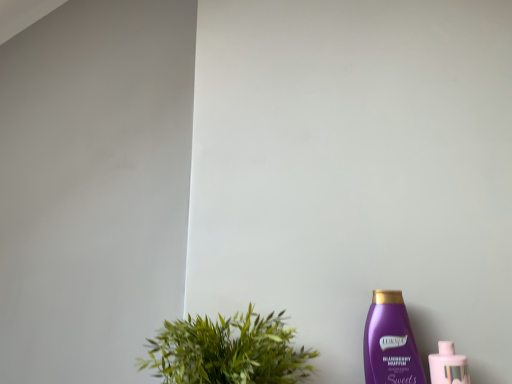
Consider the image. Measure the distance between point [200,354] and camera.

Point [200,354] and camera are 65.70 centimeters apart.

The height and width of the screenshot is (384, 512). Describe the element at coordinates (448, 365) in the screenshot. I see `pink glossy bottle at lower right, arranged as the first bottle when viewed from the right` at that location.

Measure the distance between pink glossy bottle at lower right, which is the second bottle from left to right, and camera.

pink glossy bottle at lower right, which is the second bottle from left to right, and camera are 28.83 inches apart.

The height and width of the screenshot is (384, 512). In order to click on green leafy plant at lower left in this screenshot , I will do `click(228, 351)`.

Which is more distant, [275,351] or [440,367]?

The point [440,367] is farther from the camera.

Is green leafy plant at lower left bigger or smaller than pink glossy bottle at lower right, which is the second bottle from left to right?

In the image, green leafy plant at lower left appears to be larger than pink glossy bottle at lower right, which is the second bottle from left to right.

Is green leafy plant at lower left not close to pink glossy bottle at lower right, which is the second bottle from left to right?

green leafy plant at lower left is near pink glossy bottle at lower right, which is the second bottle from left to right, not far away.

Looking at this image, is pink glossy bottle at lower right, arranged as the first bottle when viewed from the right, to the right of purple plastic bottle at lower right, marked as the second bottle in a right-to-left arrangement, from the viewer's perspective?

Indeed, pink glossy bottle at lower right, arranged as the first bottle when viewed from the right, is positioned on the right side of purple plastic bottle at lower right, marked as the second bottle in a right-to-left arrangement.

Is pink glossy bottle at lower right, which is the second bottle from left to right, not within purple plastic bottle at lower right, the first bottle in the left-to-right sequence?

pink glossy bottle at lower right, which is the second bottle from left to right, is positioned outside purple plastic bottle at lower right, the first bottle in the left-to-right sequence.

From the image's perspective, is pink glossy bottle at lower right, arranged as the first bottle when viewed from the right, above or below purple plastic bottle at lower right, marked as the second bottle in a right-to-left arrangement?

Clearly, from the image's perspective, pink glossy bottle at lower right, arranged as the first bottle when viewed from the right, is below purple plastic bottle at lower right, marked as the second bottle in a right-to-left arrangement.

You are a GUI agent. You are given a task and a screenshot of the screen. Output one action in this format:
    pyautogui.click(x=<x>, y=<y>)
    Task: Click on the bottle below the purple plastic bottle at lower right, marked as the second bottle in a right-to-left arrangement (from a real-world perspective)
    
    Given the screenshot: What is the action you would take?
    pyautogui.click(x=448, y=365)

Consider the image. Can you tell me how much purple plastic bottle at lower right, marked as the second bottle in a right-to-left arrangement, and green leafy plant at lower left differ in facing direction?

The facing directions of purple plastic bottle at lower right, marked as the second bottle in a right-to-left arrangement, and green leafy plant at lower left are 0.000581 degrees apart.

Does purple plastic bottle at lower right, marked as the second bottle in a right-to-left arrangement, contain green leafy plant at lower left?

Actually, green leafy plant at lower left is outside purple plastic bottle at lower right, marked as the second bottle in a right-to-left arrangement.

Is there a large distance between purple plastic bottle at lower right, marked as the second bottle in a right-to-left arrangement, and green leafy plant at lower left?

No, purple plastic bottle at lower right, marked as the second bottle in a right-to-left arrangement, is in close proximity to green leafy plant at lower left.

Is purple plastic bottle at lower right, marked as the second bottle in a right-to-left arrangement, thinner than pink glossy bottle at lower right, which is the second bottle from left to right?

Correct, the width of purple plastic bottle at lower right, marked as the second bottle in a right-to-left arrangement, is less than that of pink glossy bottle at lower right, which is the second bottle from left to right.

From a real-world perspective, is purple plastic bottle at lower right, marked as the second bottle in a right-to-left arrangement, physically located above or below pink glossy bottle at lower right, arranged as the first bottle when viewed from the right?

Clearly, from a real-world perspective, purple plastic bottle at lower right, marked as the second bottle in a right-to-left arrangement, is above pink glossy bottle at lower right, arranged as the first bottle when viewed from the right.

Considering the sizes of purple plastic bottle at lower right, the first bottle in the left-to-right sequence, and pink glossy bottle at lower right, which is the second bottle from left to right, in the image, is purple plastic bottle at lower right, the first bottle in the left-to-right sequence, bigger or smaller than pink glossy bottle at lower right, which is the second bottle from left to right,?

Considering their sizes, purple plastic bottle at lower right, the first bottle in the left-to-right sequence, takes up more space than pink glossy bottle at lower right, which is the second bottle from left to right.

Could you tell me if green leafy plant at lower left is turned towards purple plastic bottle at lower right, marked as the second bottle in a right-to-left arrangement?

No, green leafy plant at lower left is not aimed at purple plastic bottle at lower right, marked as the second bottle in a right-to-left arrangement.

Where is `houseplant that appears above the purple plastic bottle at lower right, marked as the second bottle in a right-to-left arrangement (from a real-world perspective)`? The width and height of the screenshot is (512, 384). houseplant that appears above the purple plastic bottle at lower right, marked as the second bottle in a right-to-left arrangement (from a real-world perspective) is located at coordinates click(228, 351).

From a real-world perspective, is green leafy plant at lower left over purple plastic bottle at lower right, marked as the second bottle in a right-to-left arrangement?

Yes, from a real-world perspective, green leafy plant at lower left is above purple plastic bottle at lower right, marked as the second bottle in a right-to-left arrangement.

Considering the points (241, 336) and (394, 339), which point is in front, point (241, 336) or point (394, 339)?

The point (394, 339) is closer to the camera.

Between pink glossy bottle at lower right, which is the second bottle from left to right, and green leafy plant at lower left, which one has smaller width?

pink glossy bottle at lower right, which is the second bottle from left to right, is thinner.

From a real-world perspective, does pink glossy bottle at lower right, arranged as the first bottle when viewed from the right, sit lower than green leafy plant at lower left?

Indeed, from a real-world perspective, pink glossy bottle at lower right, arranged as the first bottle when viewed from the right, is positioned beneath green leafy plant at lower left.

Which is correct: pink glossy bottle at lower right, arranged as the first bottle when viewed from the right, is inside green leafy plant at lower left, or outside of it?

pink glossy bottle at lower right, arranged as the first bottle when viewed from the right, exists outside the volume of green leafy plant at lower left.

Locate an element on the screen. the 2nd bottle positioned below the green leafy plant at lower left (from the image's perspective) is located at coordinates (448, 365).

The height and width of the screenshot is (384, 512). Identify the location of bottle behind the purple plastic bottle at lower right, marked as the second bottle in a right-to-left arrangement. (448, 365).

Based on the photo, which object lies nearer to the anchor point pink glossy bottle at lower right, arranged as the first bottle when viewed from the right, purple plastic bottle at lower right, the first bottle in the left-to-right sequence, or green leafy plant at lower left?

Based on the image, purple plastic bottle at lower right, the first bottle in the left-to-right sequence, appears to be nearer to pink glossy bottle at lower right, arranged as the first bottle when viewed from the right.

Based on their spatial positions, is pink glossy bottle at lower right, which is the second bottle from left to right, or green leafy plant at lower left closer to purple plastic bottle at lower right, marked as the second bottle in a right-to-left arrangement?

pink glossy bottle at lower right, which is the second bottle from left to right.

When comparing their distances from pink glossy bottle at lower right, which is the second bottle from left to right, does green leafy plant at lower left or purple plastic bottle at lower right, the first bottle in the left-to-right sequence, seem closer?

purple plastic bottle at lower right, the first bottle in the left-to-right sequence.

From the picture: Which object lies further to the anchor point green leafy plant at lower left, pink glossy bottle at lower right, arranged as the first bottle when viewed from the right, or purple plastic bottle at lower right, the first bottle in the left-to-right sequence?

Based on the image, pink glossy bottle at lower right, arranged as the first bottle when viewed from the right, appears to be further to green leafy plant at lower left.

From the image, which object appears to be nearer to purple plastic bottle at lower right, the first bottle in the left-to-right sequence, green leafy plant at lower left or pink glossy bottle at lower right, which is the second bottle from left to right?

Based on the image, pink glossy bottle at lower right, which is the second bottle from left to right, appears to be nearer to purple plastic bottle at lower right, the first bottle in the left-to-right sequence.

Looking at the image, which one is located further to green leafy plant at lower left, purple plastic bottle at lower right, the first bottle in the left-to-right sequence, or pink glossy bottle at lower right, arranged as the first bottle when viewed from the right?

The object further to green leafy plant at lower left is pink glossy bottle at lower right, arranged as the first bottle when viewed from the right.

The image size is (512, 384). In order to click on bottle between green leafy plant at lower left and pink glossy bottle at lower right, which is the second bottle from left to right, from left to right in this screenshot , I will do `click(390, 342)`.